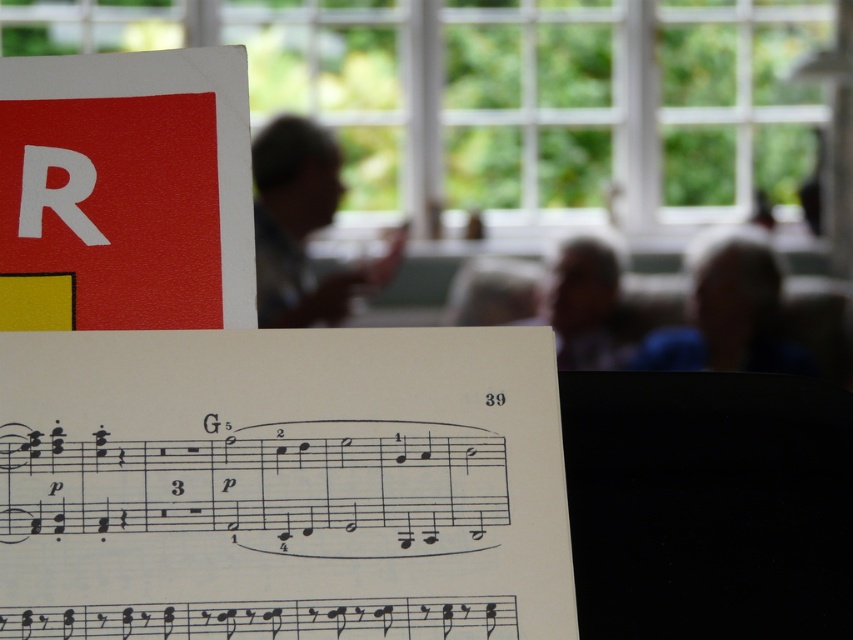
You are a musician holding a 12 inch long flute. You want to place the flute on the white paper sheet music at center. Can the flute fit on the sheet music?

The white paper sheet music at center is 18.79 inches from viewer, so the flute can fit on it since it is longer than the flute.

From the picture: You are a student trying to place a matte plastic cup at upper center on top of the white paper sheet music at center. Will the cup fit entirely on the sheet music?

The white paper sheet music at center is wider than the matte plastic cup at upper center, so the cup will fit entirely on the white paper sheet music at center.